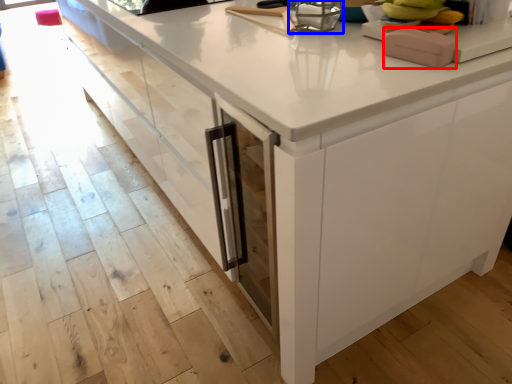
Question: Which object appears farthest to the camera in this image, appliance (highlighted by a red box) or appliance (highlighted by a blue box)?

Choices:
 (A) appliance
 (B) appliance

Answer: (B)